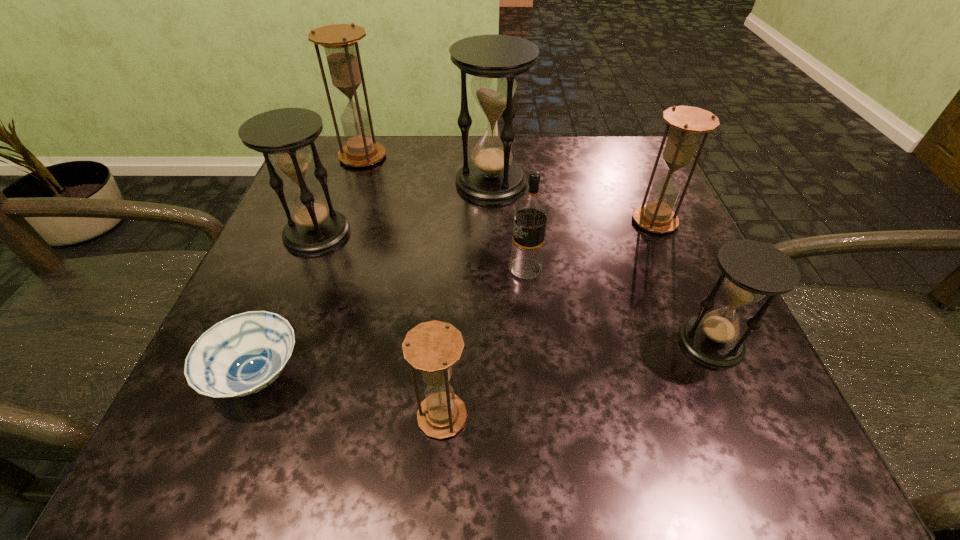
The width and height of the screenshot is (960, 540). Find the location of `brown hourglass object that ranks as the second closest to the farthest brown hourglass`. brown hourglass object that ranks as the second closest to the farthest brown hourglass is located at coordinates (432, 347).

Identify the location of the third closest brown hourglass relative to the fifth farthest object. (340, 43).

What are the coordinates of `black hourglass that stands as the second closest to the second black hourglass from left to right` in the screenshot? It's located at (752, 269).

Identify which black hourglass is the nearest to the vodka. Please provide its 2D coordinates. Your answer should be formatted as a tuple, i.e. [(x, y)], where the tuple contains the x and y coordinates of a point satisfying the conditions above.

[(491, 177)]

I want to click on free location that satisfies the following two spatial constraints: 1. on the label of the fourth nearest object; 2. on the left side of the fifth farthest hourglass, so click(533, 342).